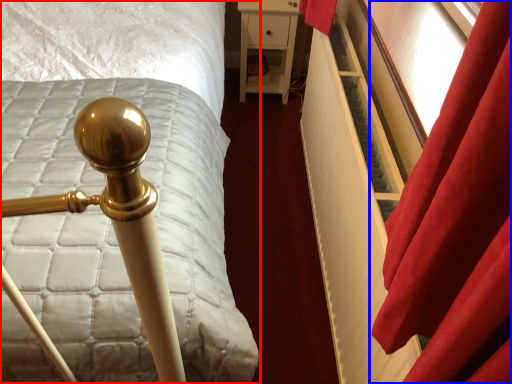
Question: Which object appears closest to the camera in this image, bed (highlighted by a red box) or curtain (highlighted by a blue box)?

Choices:
 (A) bed
 (B) curtain

Answer: (A)